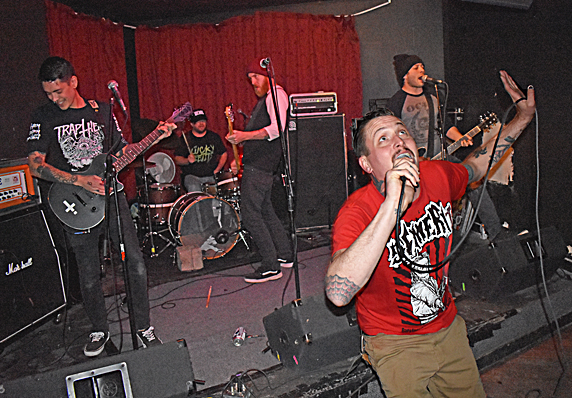
Image resolution: width=572 pixels, height=398 pixels. Find the location of `metal curtain rod`. metal curtain rod is located at coordinates (379, 6).